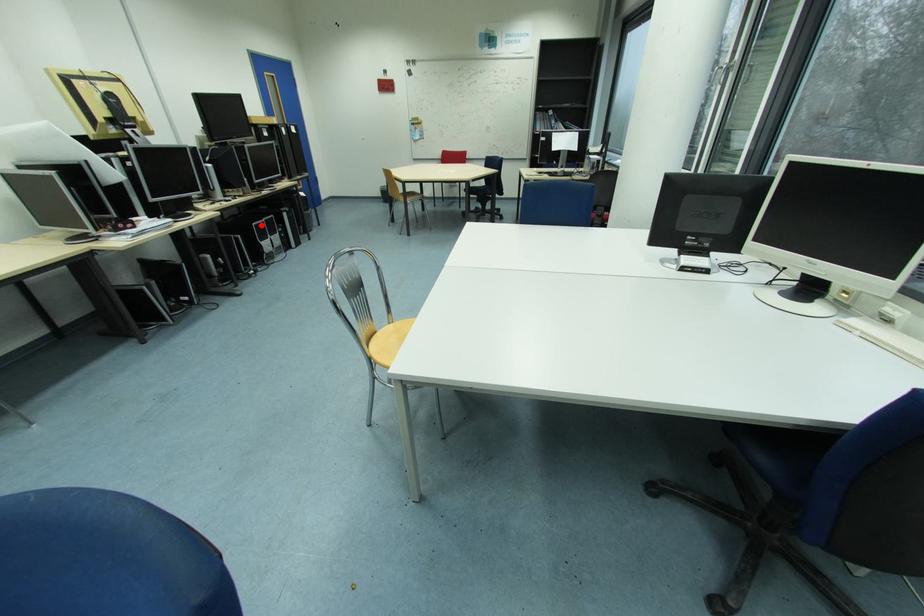
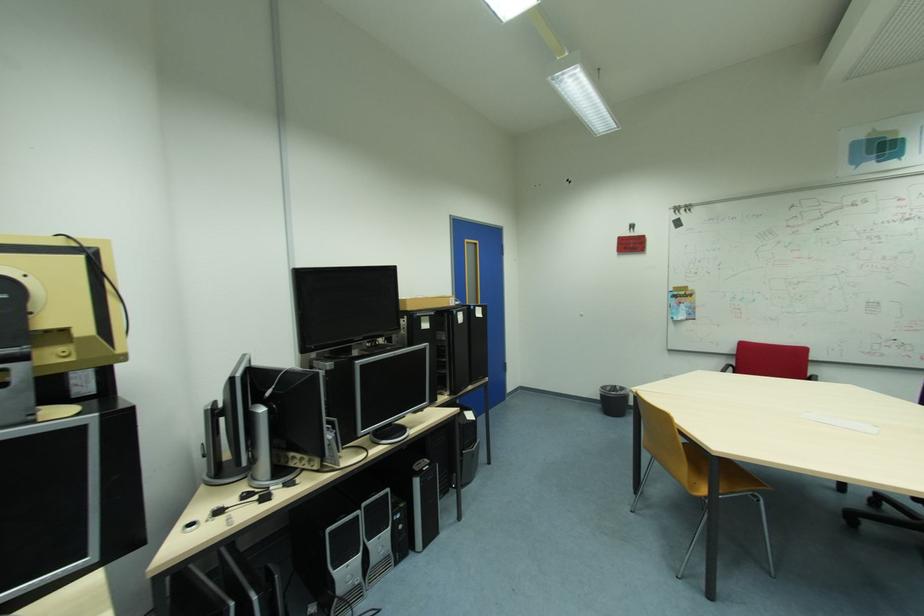
Question: I am providing you with two images of the same scene from different viewpoints. Given a red point in image1, look at the same physical point in image2. Is it:

Choices:
 (A) Closer to the viewpoint
 (B) Farther from the viewpoint

Answer: (B)